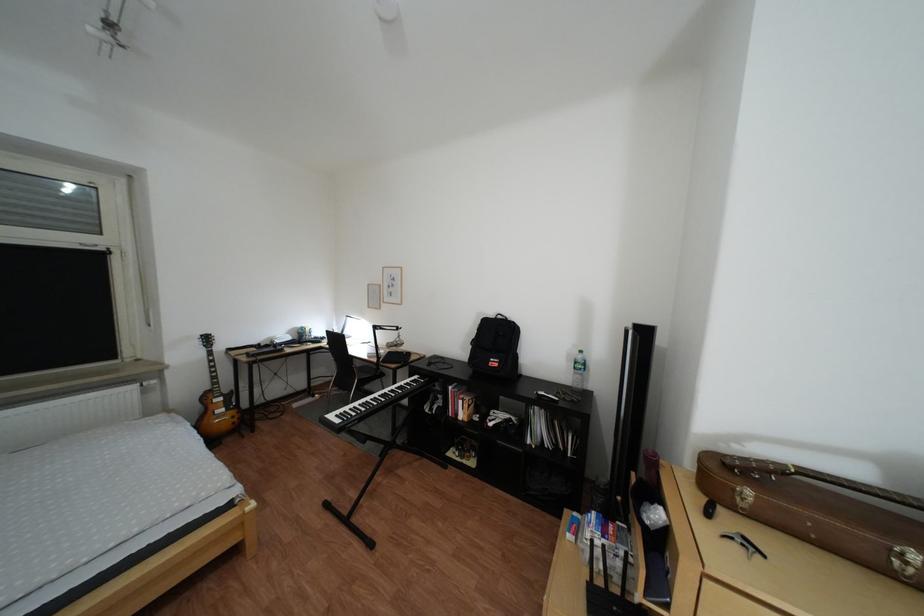
The height and width of the screenshot is (616, 924). What do you see at coordinates (214, 402) in the screenshot?
I see `the electric guitar` at bounding box center [214, 402].